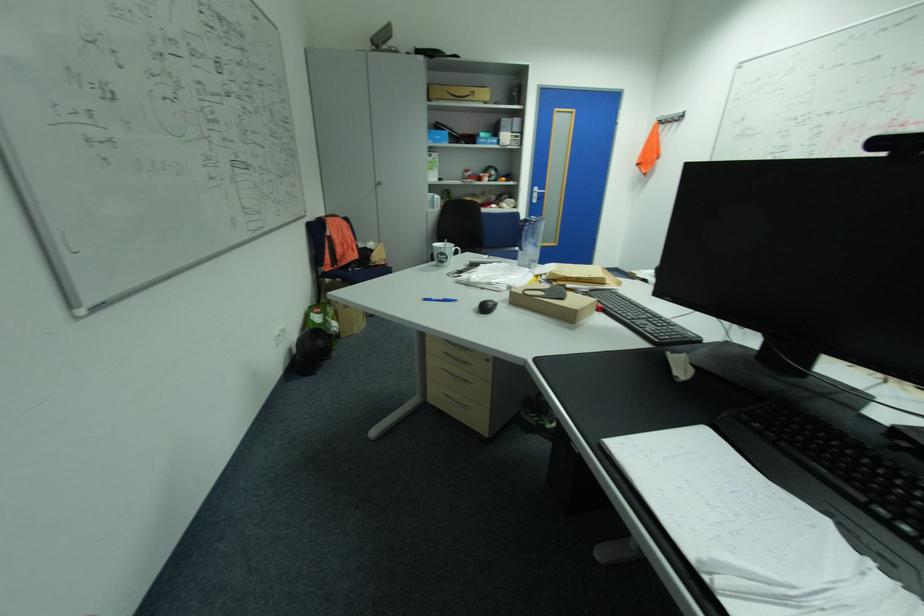
Image resolution: width=924 pixels, height=616 pixels. What do you see at coordinates (537, 193) in the screenshot?
I see `the silver door handle` at bounding box center [537, 193].